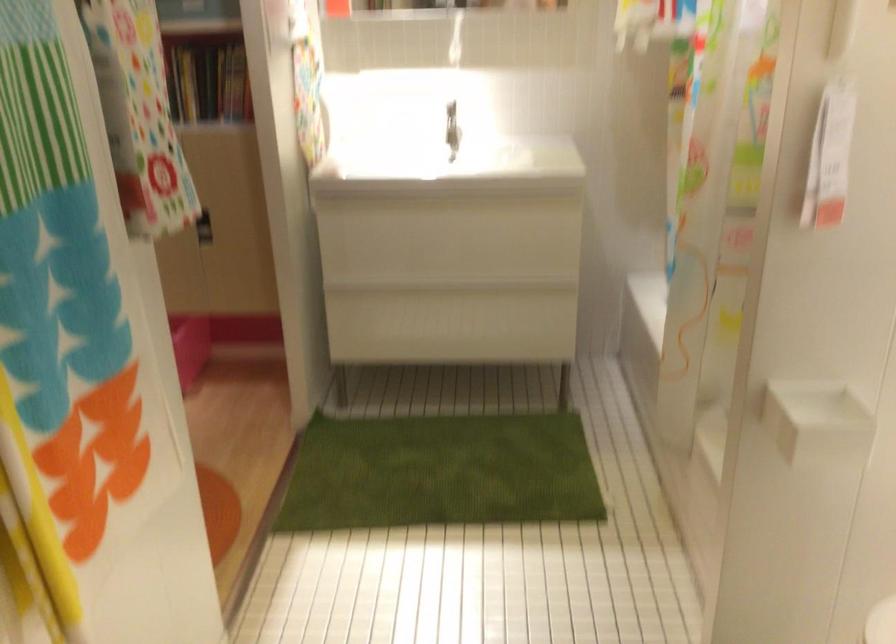
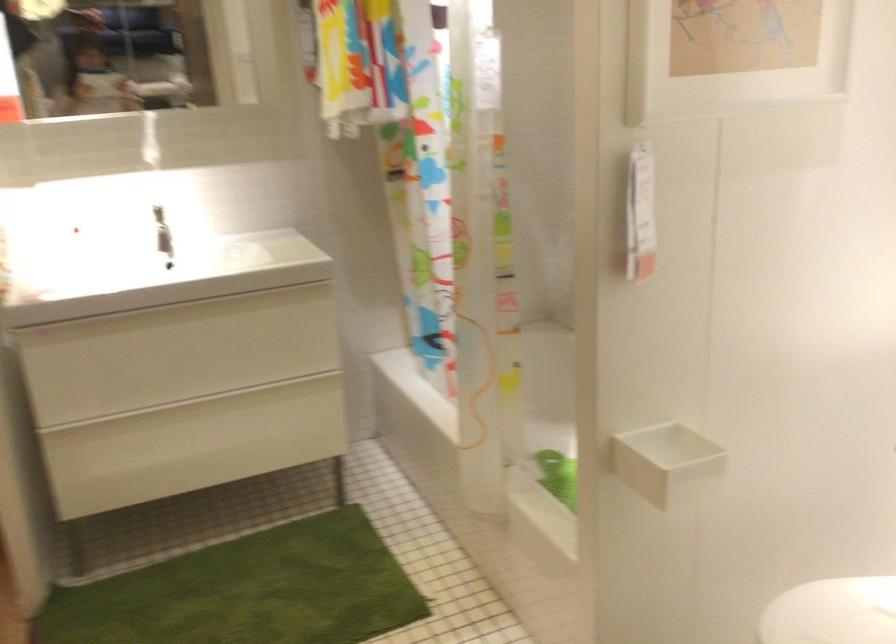
Question: The camera is either moving clockwise (left) or counter-clockwise (right) around the object. The first image is from the beginning of the video and the second image is from the end. Is the camera moving left or right when shooting the video?

Choices:
 (A) Left
 (B) Right

Answer: (A)